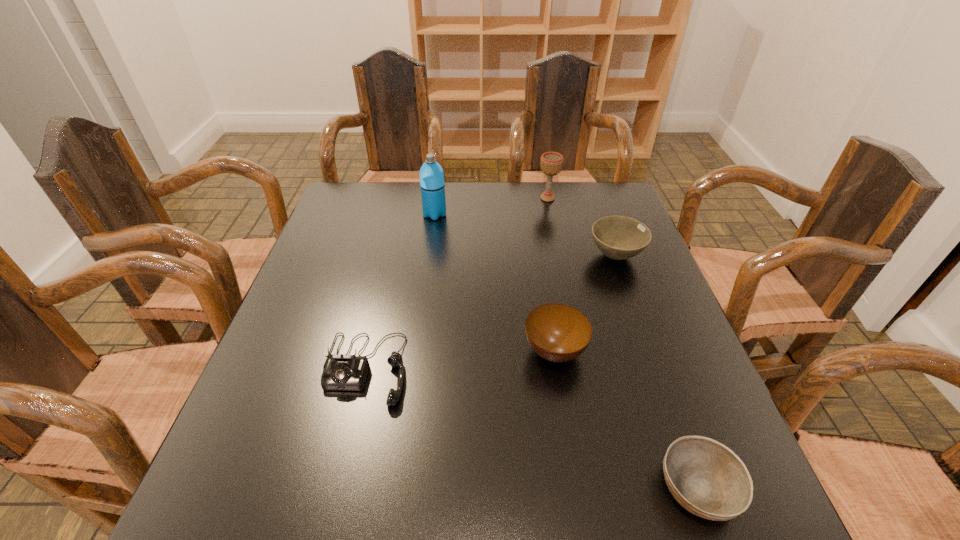
This screenshot has height=540, width=960. What are the coordinates of `free spot that satisfies the following two spatial constraints: 1. on the dial of the shortest bowl; 2. on the right side of the telephone` in the screenshot? It's located at [x=337, y=487].